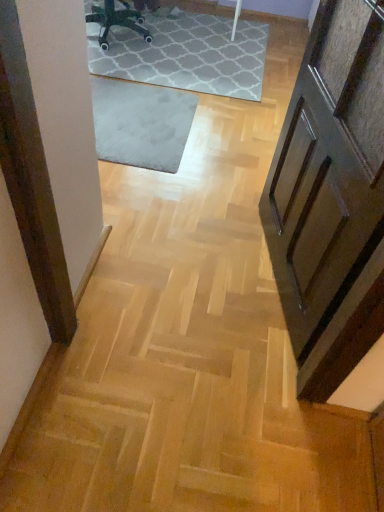
Question: Is black plastic chair at upper center oriented towards gray soft rug at center?

Choices:
 (A) yes
 (B) no

Answer: (B)

Question: Is black plastic chair at upper center located outside gray soft rug at center?

Choices:
 (A) yes
 (B) no

Answer: (A)

Question: Can you confirm if black plastic chair at upper center is smaller than gray soft rug at center?

Choices:
 (A) no
 (B) yes

Answer: (B)

Question: Are black plastic chair at upper center and gray soft rug at center located far from each other?

Choices:
 (A) no
 (B) yes

Answer: (A)

Question: Considering the relative positions of black plastic chair at upper center and gray soft rug at center in the image provided, is black plastic chair at upper center to the right of gray soft rug at center from the viewer's perspective?

Choices:
 (A) yes
 (B) no

Answer: (B)

Question: Is black plastic chair at upper center with gray soft rug at center?

Choices:
 (A) no
 (B) yes

Answer: (A)

Question: Can you confirm if gray soft rug at center is wider than black plastic chair at upper center?

Choices:
 (A) yes
 (B) no

Answer: (A)

Question: Is gray soft rug at center far away from black plastic chair at upper center?

Choices:
 (A) yes
 (B) no

Answer: (B)

Question: Considering the relative sizes of gray soft rug at center and black plastic chair at upper center in the image provided, is gray soft rug at center shorter than black plastic chair at upper center?

Choices:
 (A) yes
 (B) no

Answer: (A)

Question: Can we say gray soft rug at center lies outside black plastic chair at upper center?

Choices:
 (A) yes
 (B) no

Answer: (A)

Question: Is gray soft rug at center positioned with its back to black plastic chair at upper center?

Choices:
 (A) yes
 (B) no

Answer: (B)

Question: Can you confirm if gray soft rug at center is positioned to the right of black plastic chair at upper center?

Choices:
 (A) yes
 (B) no

Answer: (A)

Question: Does wooden panelled door at right appear on the left side of black plastic chair at upper center?

Choices:
 (A) yes
 (B) no

Answer: (B)